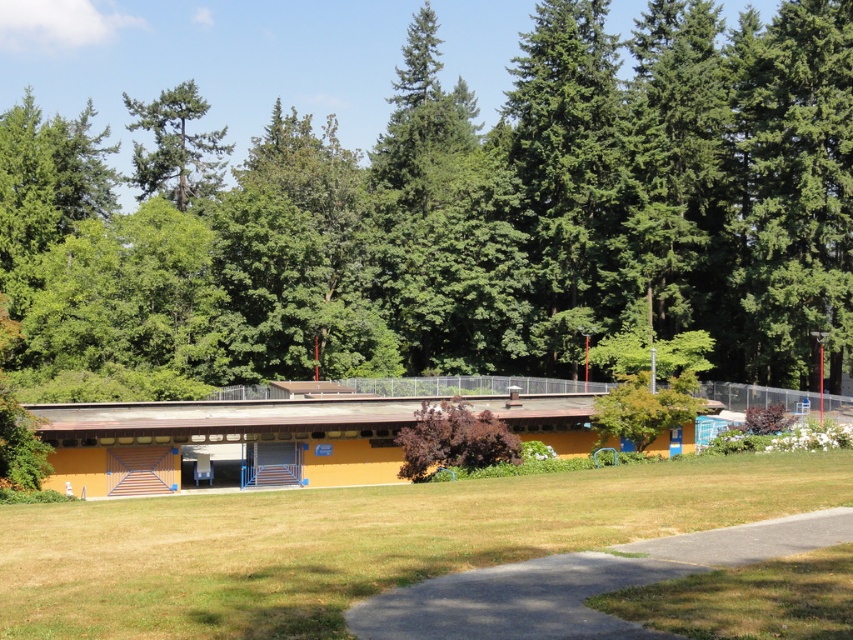
Question: Is green grass at center smaller than green matte tree at upper center?

Choices:
 (A) yes
 (B) no

Answer: (A)

Question: Is green grass at center to the right of green matte tree at upper center from the viewer's perspective?

Choices:
 (A) no
 (B) yes

Answer: (B)

Question: Which of the following is the closest to the observer?

Choices:
 (A) (193, 195)
 (B) (271, 570)

Answer: (B)

Question: Does green grass at center appear on the right side of green matte tree at upper center?

Choices:
 (A) yes
 (B) no

Answer: (A)

Question: Which of the following is the closest to the observer?

Choices:
 (A) (165, 145)
 (B) (196, 579)

Answer: (B)

Question: Which of the following is the closest to the observer?

Choices:
 (A) (711, 502)
 (B) (158, 145)

Answer: (A)